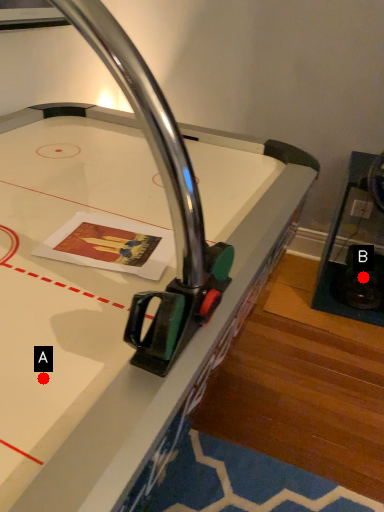
Question: Two points are circled on the image, labeled by A and B beside each circle. Which point is closer to the camera?

Choices:
 (A) A is closer
 (B) B is closer

Answer: (A)